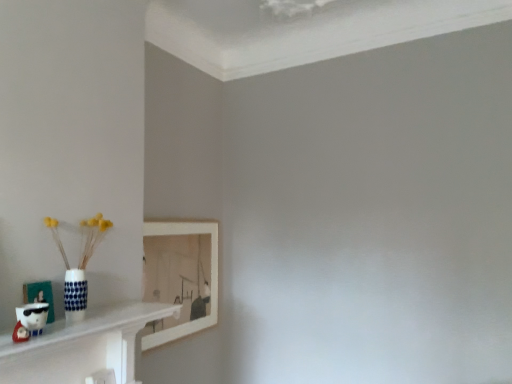
Question: Which is correct: matte white picture frame at lower left, positioned as the 1th picture frame in front-to-back order, is inside white glossy shelf at lower left, or outside of it?

Choices:
 (A) inside
 (B) outside

Answer: (B)

Question: Considering the positions of matte white picture frame at lower left, positioned as the 1th picture frame in front-to-back order, and white glossy shelf at lower left in the image, is matte white picture frame at lower left, positioned as the 1th picture frame in front-to-back order, wider or thinner than white glossy shelf at lower left?

Choices:
 (A) wide
 (B) thin

Answer: (B)

Question: Which object is positioned farthest from the white wooden picture frame at upper left, which ranks as the first picture frame in back-to-front order?

Choices:
 (A) matte white picture frame at lower left, positioned as the 1th picture frame in front-to-back order
 (B) white glossy shelf at lower left

Answer: (A)

Question: Estimate the real-world distances between objects in this image. Which object is farther from the white wooden picture frame at upper left, which is the 2th picture frame from left to right?

Choices:
 (A) matte white picture frame at lower left, which appears as the 1th picture frame when viewed from the left
 (B) white glossy shelf at lower left

Answer: (A)